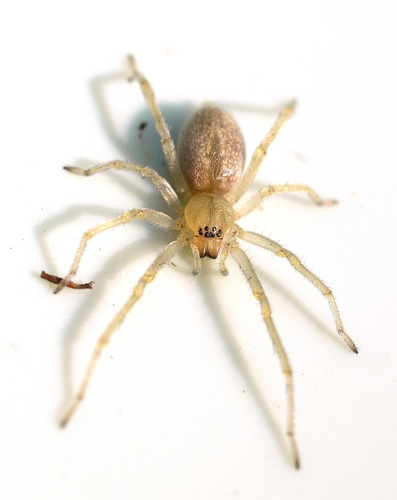
You are a GUI agent. You are given a task and a screenshot of the screen. Output one action in this format:
    pyautogui.click(x=<x>, y=<y>)
    Task: Click on the surface
    Image resolution: width=397 pixels, height=500 pixels.
    Given the screenshot: What is the action you would take?
    pyautogui.click(x=348, y=266)